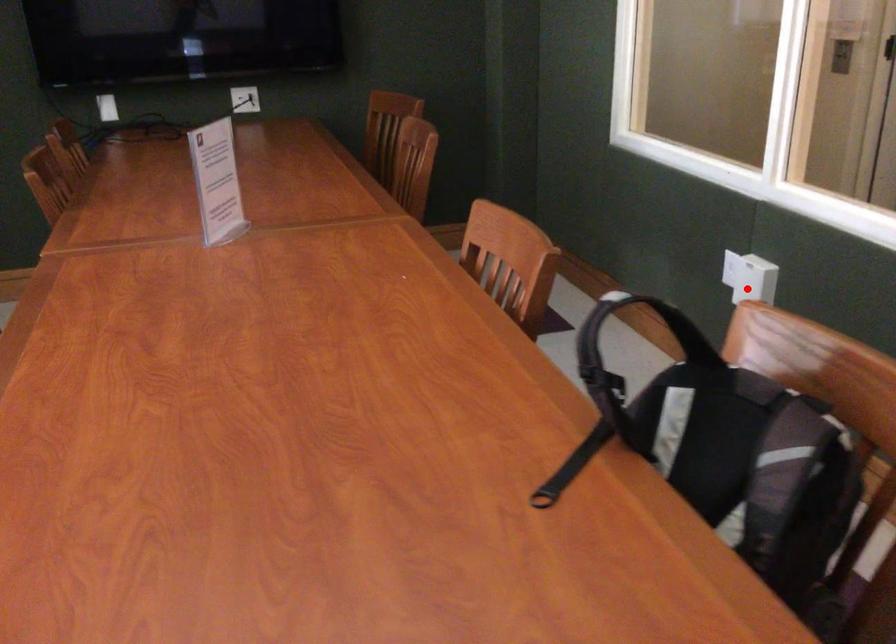
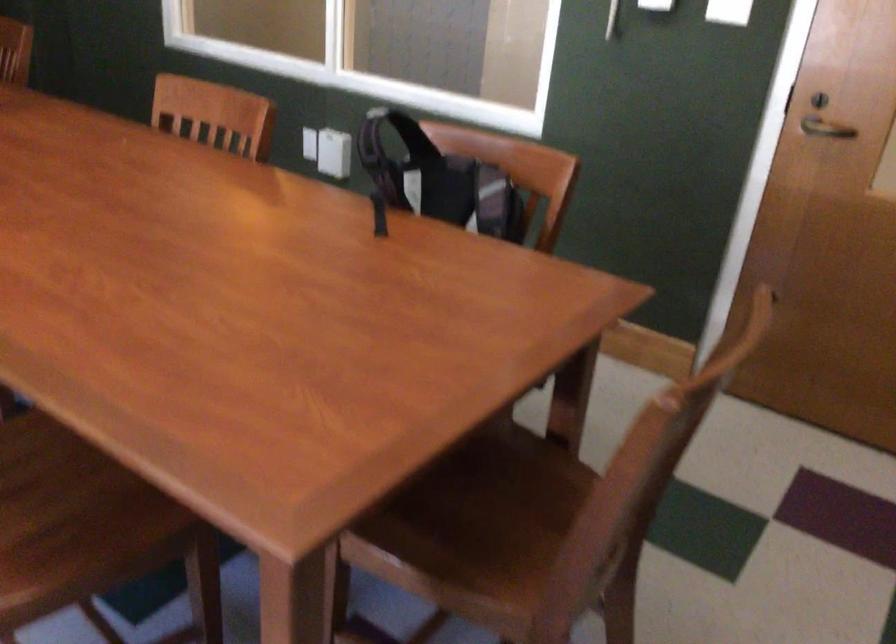
The point at the highlighted location is marked in the first image. Where is the corresponding point in the second image?

(333, 153)